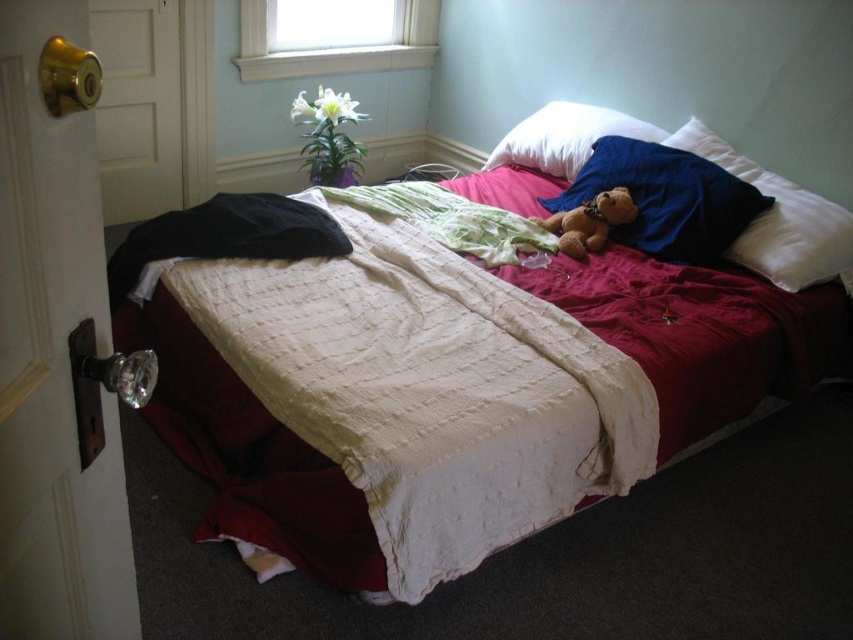
Describe the element at coordinates (666, 198) in the screenshot. The height and width of the screenshot is (640, 853). I see `soft blue pillow at upper right` at that location.

Is soft blue pillow at upper right taller than white soft pillow at upper right?

In fact, soft blue pillow at upper right may be shorter than white soft pillow at upper right.

Is point (682, 186) positioned before point (808, 216)?

No, (682, 186) is further to viewer.

The height and width of the screenshot is (640, 853). What are the coordinates of `soft blue pillow at upper right` in the screenshot? It's located at (666, 198).

Which is below, white quilted bed at center or white soft pillow at upper center?

white quilted bed at center

Does white quilted bed at center appear under white soft pillow at upper center?

Correct, white quilted bed at center is located below white soft pillow at upper center.

This screenshot has height=640, width=853. Find the location of `white quilted bed at center`. white quilted bed at center is located at coordinates (426, 387).

Between white soft pillow at upper right and white soft pillow at upper center, which one appears on the left side from the viewer's perspective?

Positioned to the left is white soft pillow at upper center.

Does white soft pillow at upper right appear over white soft pillow at upper center?

Actually, white soft pillow at upper right is below white soft pillow at upper center.

Is point (778, 184) less distant than point (554, 136)?

Yes, it is.

At what (x,y) coordinates should I click in order to perform the action: click on white soft pillow at upper right. Please return your answer as a coordinate pair (x, y). Looking at the image, I should click on (779, 220).